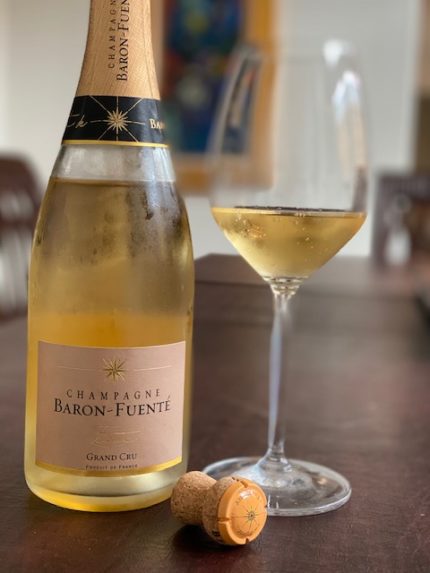
At what (x,y) coordinates should I click in order to perform the action: click on empty space on wall behind champagne glass. Please return your answer as a coordinate pair (x, y). Looking at the image, I should click on (403, 61).